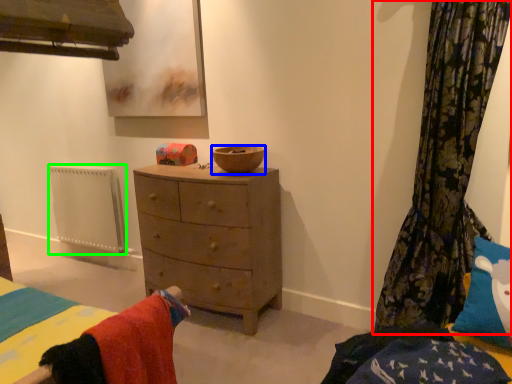
Question: Which is nearer to the curtain (highlighted by a red box)? bowl (highlighted by a blue box) or radiator (highlighted by a green box).

Choices:
 (A) bowl
 (B) radiator

Answer: (A)